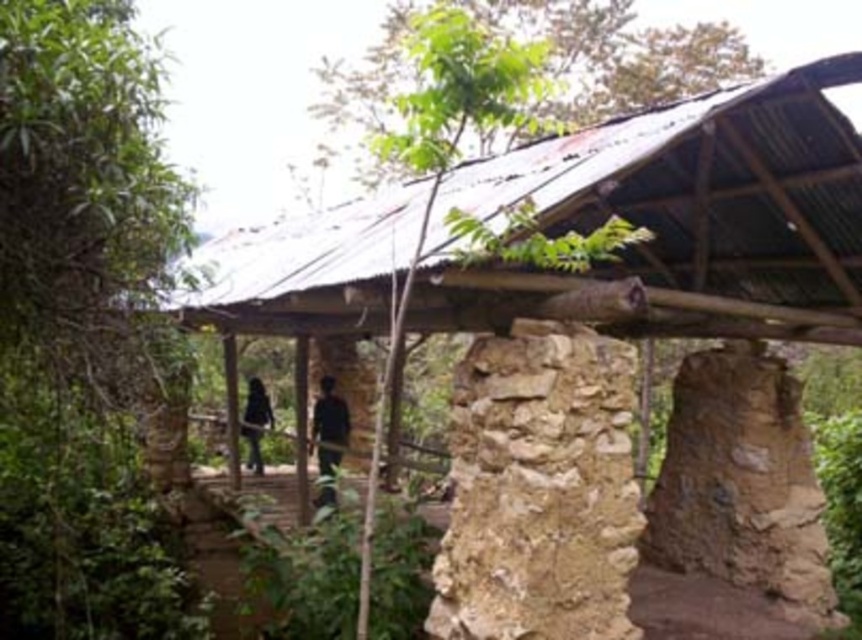
Consider the image. You are a hiker who has just arrived at the rustic structure in the forest. You notice two items at the center of the scene. What is the relationship between the dark blue fabric at center and the black matte clothing at center?

The dark blue fabric at center is positioned over the black matte clothing at center.

Looking at this image, you are standing at the center of the rustic structure and want to locate the green leafy tree at left. According to the coordinates provided, in which direction should you face to see it?

The green leafy tree at left is located at coordinates point (80,324). Since you are at the center, facing the direction corresponding to these coordinates would allow you to see the tree. Typically, in such coordinate systems, the x and y values determine left, right, up, or down. Here, the x value of 0.508 suggests a position to the right of the center, while the y value of 0.094 indicates a lower position, so you should face towards the lower right direction to see the green leafy tree at left.